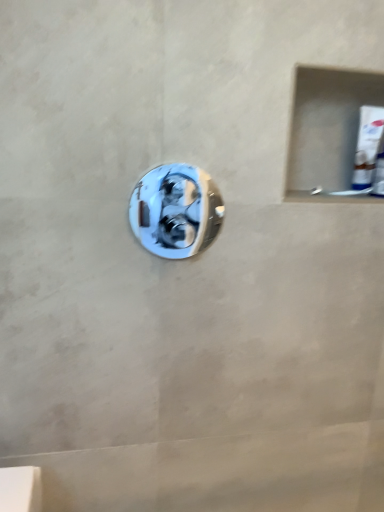
Question: Is polished chrome door handle at center facing away from white glossy tube at upper right?

Choices:
 (A) yes
 (B) no

Answer: (B)

Question: Is polished chrome door handle at center outside white glossy tube at upper right?

Choices:
 (A) yes
 (B) no

Answer: (A)

Question: Considering the relative sizes of polished chrome door handle at center and white glossy tube at upper right in the image provided, is polished chrome door handle at center smaller than white glossy tube at upper right?

Choices:
 (A) no
 (B) yes

Answer: (B)

Question: Is the surface of polished chrome door handle at center in direct contact with white glossy tube at upper right?

Choices:
 (A) no
 (B) yes

Answer: (A)

Question: Is polished chrome door handle at center not near white glossy tube at upper right?

Choices:
 (A) yes
 (B) no

Answer: (B)

Question: From a real-world perspective, is polished chrome door handle at center located beneath white glossy tube at upper right?

Choices:
 (A) no
 (B) yes

Answer: (B)

Question: From the image's perspective, is white glossy tube at upper right located beneath polished chrome door handle at center?

Choices:
 (A) yes
 (B) no

Answer: (B)

Question: Could you tell me if white glossy tube at upper right is turned towards polished chrome door handle at center?

Choices:
 (A) no
 (B) yes

Answer: (A)

Question: Is white glossy tube at upper right positioned in front of polished chrome door handle at center?

Choices:
 (A) no
 (B) yes

Answer: (A)

Question: From a real-world perspective, is white glossy tube at upper right positioned over polished chrome door handle at center based on gravity?

Choices:
 (A) yes
 (B) no

Answer: (A)

Question: From a real-world perspective, is white glossy tube at upper right under polished chrome door handle at center?

Choices:
 (A) no
 (B) yes

Answer: (A)

Question: Can polished chrome door handle at center be found inside white glossy tube at upper right?

Choices:
 (A) yes
 (B) no

Answer: (B)

Question: Looking at the image, does polished chrome door handle at center seem bigger or smaller compared to white glossy tube at upper right?

Choices:
 (A) big
 (B) small

Answer: (B)